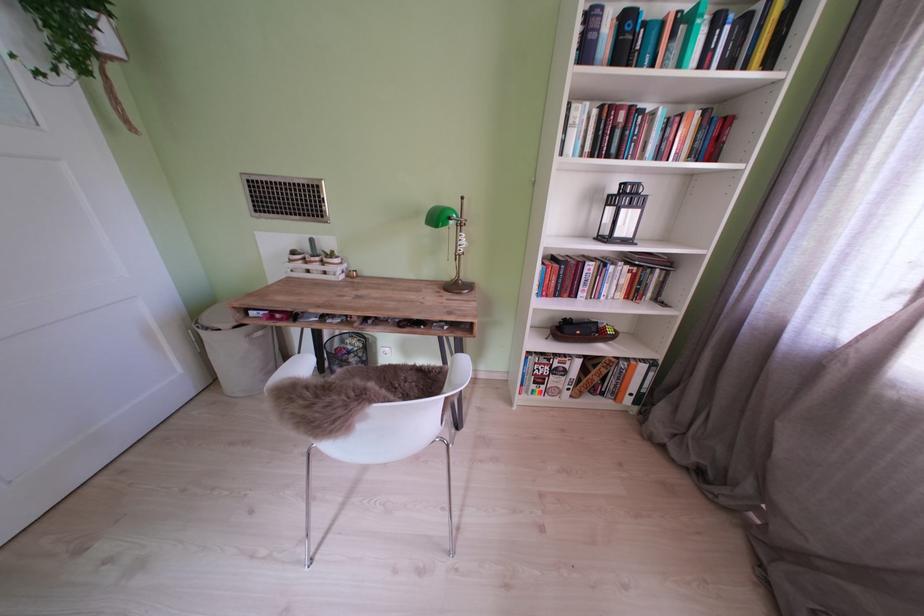
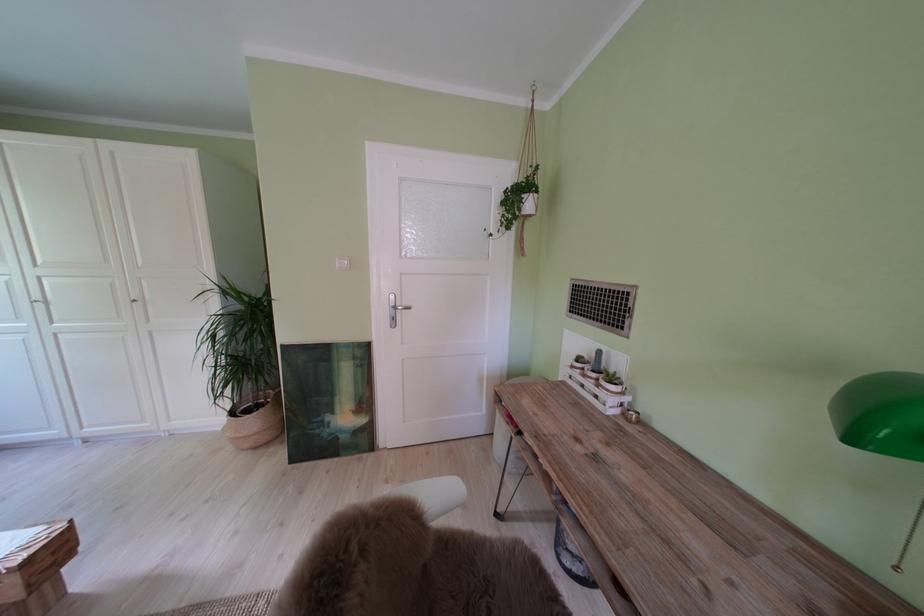
Find the pixel in the second image that matches [329,264] in the first image.

(604, 381)